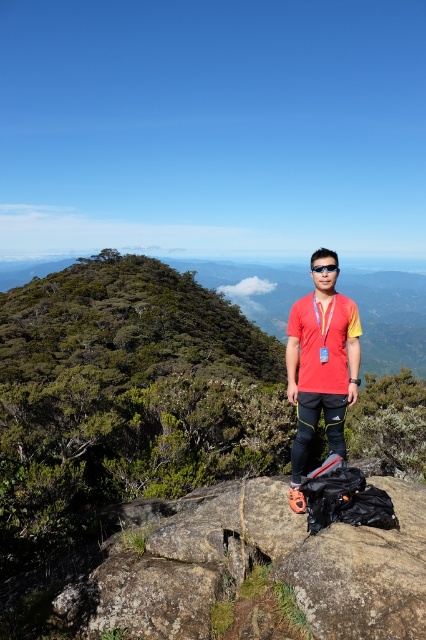
Question: From the image, what is the correct spatial relationship of rough granite rock at center in relation to red plastic goggles at center?

Choices:
 (A) above
 (B) below

Answer: (B)

Question: Which object is the farthest from the red plastic goggles at center?

Choices:
 (A) red matte shirt at center
 (B) rough granite rock at center

Answer: (A)

Question: Is red matte shirt at center further to the viewer compared to red plastic goggles at center?

Choices:
 (A) no
 (B) yes

Answer: (B)

Question: Can you confirm if rough granite rock at center is wider than red matte shirt at center?

Choices:
 (A) yes
 (B) no

Answer: (A)

Question: Which of these objects is positioned farthest from the red plastic goggles at center?

Choices:
 (A) rough granite rock at center
 (B) red matte shirt at center

Answer: (B)

Question: Which of the following is the closest to the observer?

Choices:
 (A) (314, 604)
 (B) (334, 273)
 (C) (333, 269)

Answer: (A)